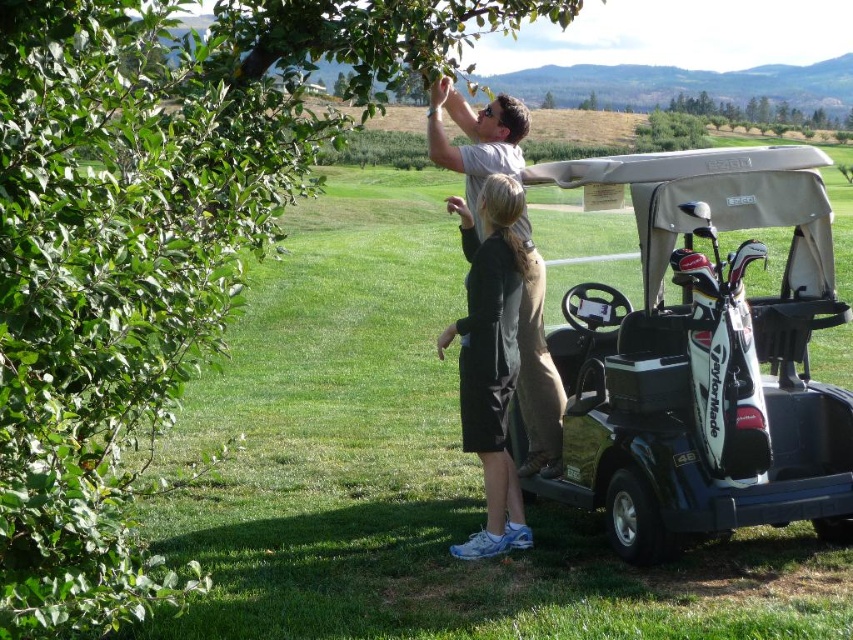
Who is more distant from viewer, (x=231, y=13) or (x=463, y=227)?

The point (x=463, y=227) is more distant.

Is green leafy tree at upper left to the left of black matte dress at center from the viewer's perspective?

Indeed, green leafy tree at upper left is positioned on the left side of black matte dress at center.

Which is behind, point (111, 81) or point (502, 477)?

Positioned behind is point (502, 477).

You are a GUI agent. You are given a task and a screenshot of the screen. Output one action in this format:
    pyautogui.click(x=<x>, y=<y>)
    Task: Click on the green leafy tree at upper left
    This screenshot has width=853, height=640.
    Given the screenshot: What is the action you would take?
    pyautogui.click(x=152, y=246)

Can you confirm if black matte dress at center is smaller than light gray cotton shirt at upper center?

Incorrect, black matte dress at center is not smaller in size than light gray cotton shirt at upper center.

Who is higher up, black matte dress at center or light gray cotton shirt at upper center?

black matte dress at center is above.

Describe the element at coordinates (490, 358) in the screenshot. This screenshot has width=853, height=640. I see `black matte dress at center` at that location.

I want to click on black matte dress at center, so click(x=490, y=358).

Which is behind, point (471, 504) or point (775, 513)?

Point (471, 504)

Is point (270, 353) closer to camera compared to point (822, 180)?

No, it is behind (822, 180).

The height and width of the screenshot is (640, 853). I want to click on green grass at center, so click(x=361, y=456).

Identify the location of green grass at center. (361, 456).